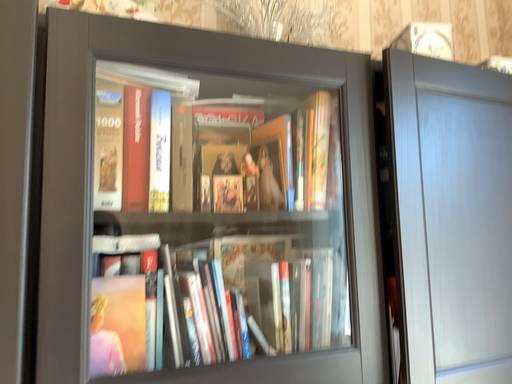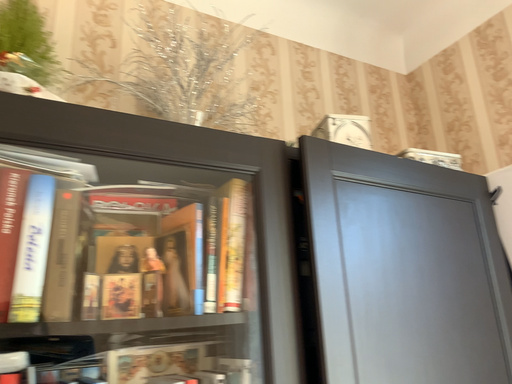
Question: How did the camera likely rotate when shooting the video?

Choices:
 (A) rotated left
 (B) rotated right

Answer: (B)